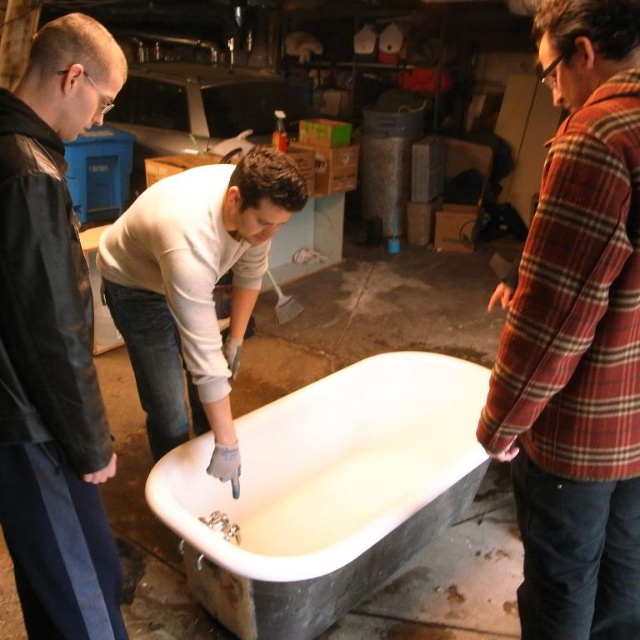
Which is above, red plaid shirt at right or black leather jacket at left?

Positioned higher is red plaid shirt at right.

You are a GUI agent. You are given a task and a screenshot of the screen. Output one action in this format:
    pyautogui.click(x=<x>, y=<y>)
    Task: Click on the red plaid shirt at right
    The width and height of the screenshot is (640, 640).
    Given the screenshot: What is the action you would take?
    pyautogui.click(x=577, y=337)

Is black leather jacket at left wider than white matte bathtub at center?

No, black leather jacket at left is not wider than white matte bathtub at center.

Is black leather jacket at left taller than white matte bathtub at center?

Indeed, black leather jacket at left has a greater height compared to white matte bathtub at center.

At what (x,y) coordinates should I click in order to perform the action: click on black leather jacket at left. Please return your answer as a coordinate pair (x, y). This screenshot has height=640, width=640. Looking at the image, I should click on (52, 342).

Does white glossy bathtub at center have a greater height compared to black leather jacket at left?

No.

Is white glossy bathtub at center bigger than black leather jacket at left?

Correct, white glossy bathtub at center is larger in size than black leather jacket at left.

Which is in front, point (284, 621) or point (3, 216)?

Point (3, 216) is more forward.

Find the location of a particular element. white glossy bathtub at center is located at coordinates (324, 492).